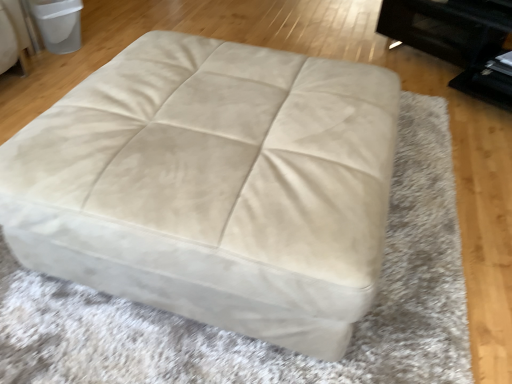
The image size is (512, 384). Describe the element at coordinates (58, 24) in the screenshot. I see `beige suede ottoman at upper left` at that location.

Locate an element on the screen. The image size is (512, 384). beige suede ottoman at upper left is located at coordinates (58, 24).

This screenshot has width=512, height=384. What do you see at coordinates (213, 186) in the screenshot?
I see `beige suede ottoman at center` at bounding box center [213, 186].

What is the approximate width of beige suede ottoman at center?

It is 1.05 meters.

The width and height of the screenshot is (512, 384). Find the location of `beige suede ottoman at center`. beige suede ottoman at center is located at coordinates (213, 186).

The width and height of the screenshot is (512, 384). Find the location of `beige suede ottoman at upper left`. beige suede ottoman at upper left is located at coordinates (58, 24).

Which object is positioned more to the left, beige suede ottoman at center or beige suede ottoman at upper left?

Positioned to the left is beige suede ottoman at upper left.

Which object is closer to the camera, beige suede ottoman at center or beige suede ottoman at upper left?

beige suede ottoman at center is closer to the camera.

Which is closer, (111,116) or (69,10)?

Point (111,116)

From the image's perspective, is beige suede ottoman at center beneath beige suede ottoman at upper left?

Indeed, from the image's perspective, beige suede ottoman at center is shown beneath beige suede ottoman at upper left.

From a real-world perspective, is beige suede ottoman at center above or below beige suede ottoman at upper left?

In terms of real-world spatial position, beige suede ottoman at center is above beige suede ottoman at upper left.

Can you confirm if beige suede ottoman at center is wider than beige suede ottoman at upper left?

Indeed, beige suede ottoman at center has a greater width compared to beige suede ottoman at upper left.

Considering the relative sizes of beige suede ottoman at center and beige suede ottoman at upper left in the image provided, is beige suede ottoman at center shorter than beige suede ottoman at upper left?

Incorrect, the height of beige suede ottoman at center does not fall short of that of beige suede ottoman at upper left.

In terms of size, does beige suede ottoman at center appear bigger or smaller than beige suede ottoman at upper left?

Clearly, beige suede ottoman at center is larger in size than beige suede ottoman at upper left.

Could beige suede ottoman at upper left be considered to be inside beige suede ottoman at center?

No, beige suede ottoman at upper left is not surrounded by beige suede ottoman at center.

Is there a large distance between beige suede ottoman at center and beige suede ottoman at upper left?

Indeed, beige suede ottoman at center is not near beige suede ottoman at upper left.

Is beige suede ottoman at center oriented towards beige suede ottoman at upper left?

No, beige suede ottoman at center is not oriented towards beige suede ottoman at upper left.

Identify the location of furniture that appears on the right of beige suede ottoman at upper left. Image resolution: width=512 pixels, height=384 pixels. (213, 186).

Looking at this image, considering the positions of objects beige suede ottoman at upper left and beige suede ottoman at center in the image provided, who is more to the left, beige suede ottoman at upper left or beige suede ottoman at center?

beige suede ottoman at upper left.

Is beige suede ottoman at upper left positioned in front of beige suede ottoman at center?

No, beige suede ottoman at upper left is further to the viewer.

Is point (72, 16) closer or farther from the camera than point (282, 180)?

Point (72, 16) is positioned farther from the camera compared to point (282, 180).

From the image's perspective, which one is positioned lower, beige suede ottoman at upper left or beige suede ottoman at center?

beige suede ottoman at center is shown below in the image.

From a real-world perspective, between beige suede ottoman at upper left and beige suede ottoman at center, who is vertically higher?

beige suede ottoman at center is physically above.

Considering the relative sizes of beige suede ottoman at upper left and beige suede ottoman at center in the image provided, is beige suede ottoman at upper left thinner than beige suede ottoman at center?

Correct, the width of beige suede ottoman at upper left is less than that of beige suede ottoman at center.

Between beige suede ottoman at upper left and beige suede ottoman at center, which one has more height?

With more height is beige suede ottoman at center.

Based on their sizes in the image, would you say beige suede ottoman at upper left is bigger or smaller than beige suede ottoman at center?

Clearly, beige suede ottoman at upper left is smaller in size than beige suede ottoman at center.

From the picture: Could beige suede ottoman at center be considered to be inside beige suede ottoman at upper left?

No, beige suede ottoman at center is not a part of beige suede ottoman at upper left.

Is beige suede ottoman at upper left positioned far away from beige suede ottoman at center?

That's right, there is a large distance between beige suede ottoman at upper left and beige suede ottoman at center.

Is beige suede ottoman at center at the back of beige suede ottoman at upper left?

No.

Locate an element on the screen. This screenshot has height=384, width=512. bean bag chair below the beige suede ottoman at center (from a real-world perspective) is located at coordinates (58, 24).

Locate an element on the screen. bean bag chair above the beige suede ottoman at center (from the image's perspective) is located at coordinates (58, 24).

Find the location of a particular element. The width and height of the screenshot is (512, 384). bean bag chair located behind the beige suede ottoman at center is located at coordinates (58, 24).